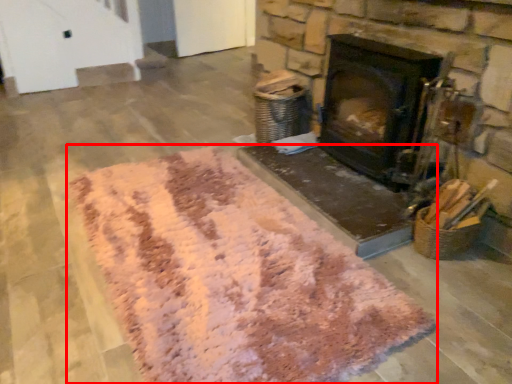
Question: From the image's perspective, considering the relative positions of mat (annotated by the red box) and wood burning stove in the image provided, where is mat (annotated by the red box) located with respect to the staircase?

Choices:
 (A) below
 (B) above

Answer: (A)